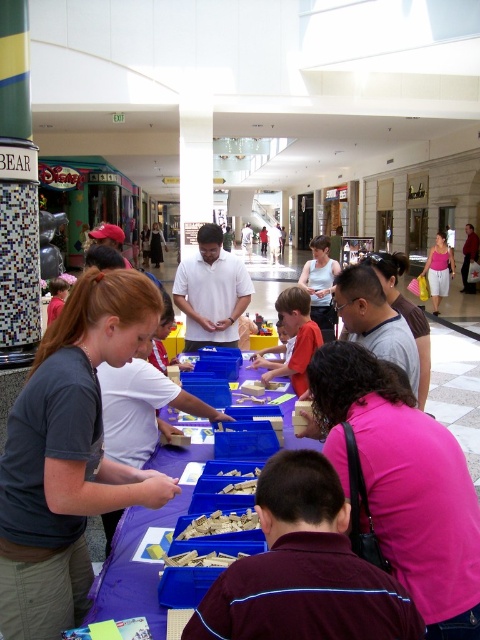
You are a parent at the mall and want to give your child a snack. You see the light brown wooden toy at center and the crumbly yellow cake at center. Which item can you give to your child to eat?

The crumbly yellow cake at center is edible and can be given to your child to eat, while the light brown wooden toy at center is not food.